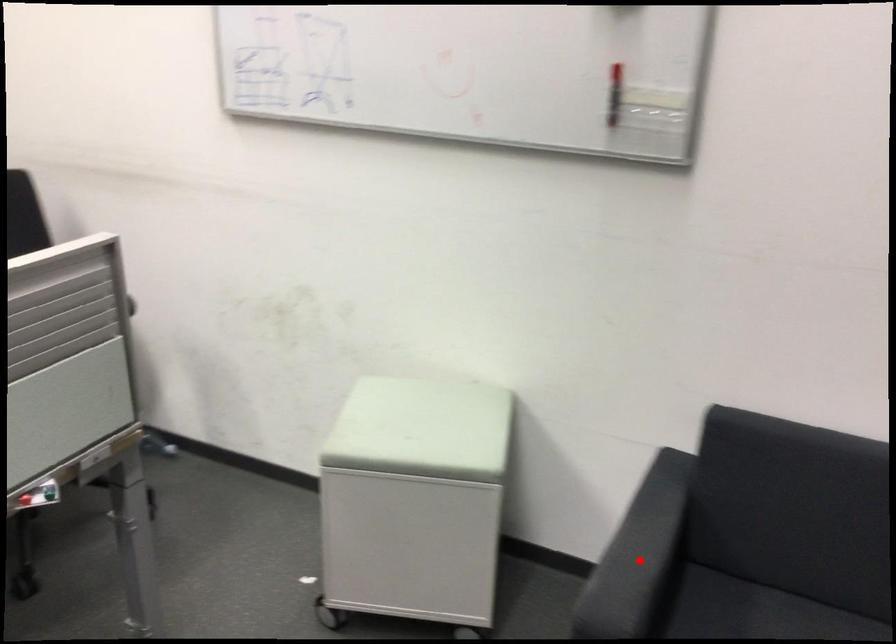
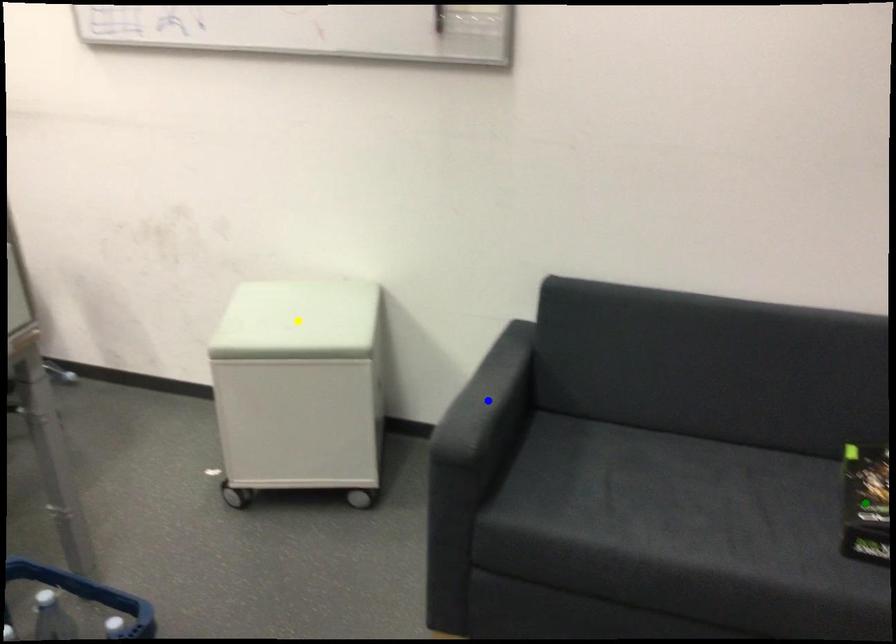
Question: I am providing you with two images of the same scene from different viewpoints. A red point is marked on the first image. You are given multiple points on the second image. Which mark in image 2 goes with the point in image 1?

Choices:
 (A) yellow point
 (B) green point
 (C) blue point

Answer: (C)